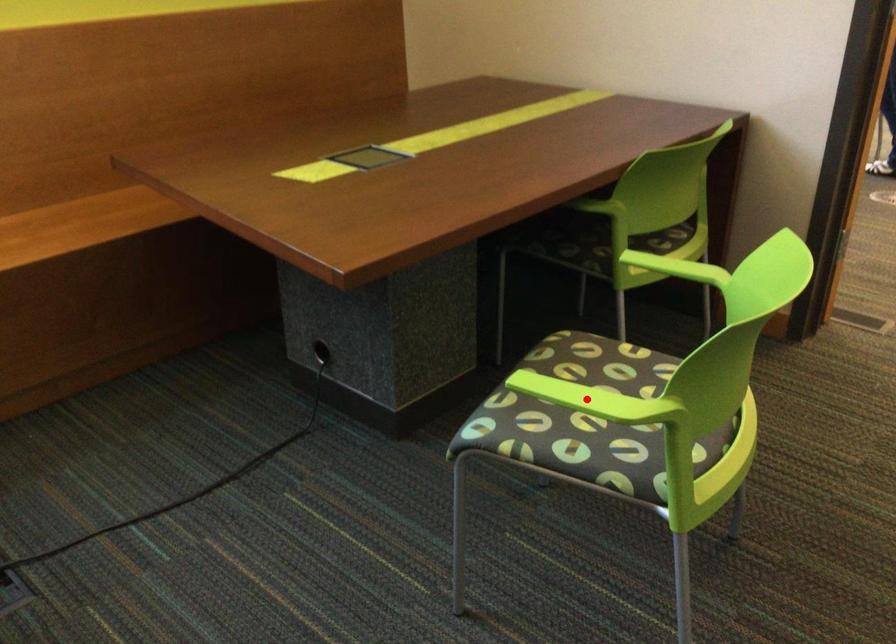
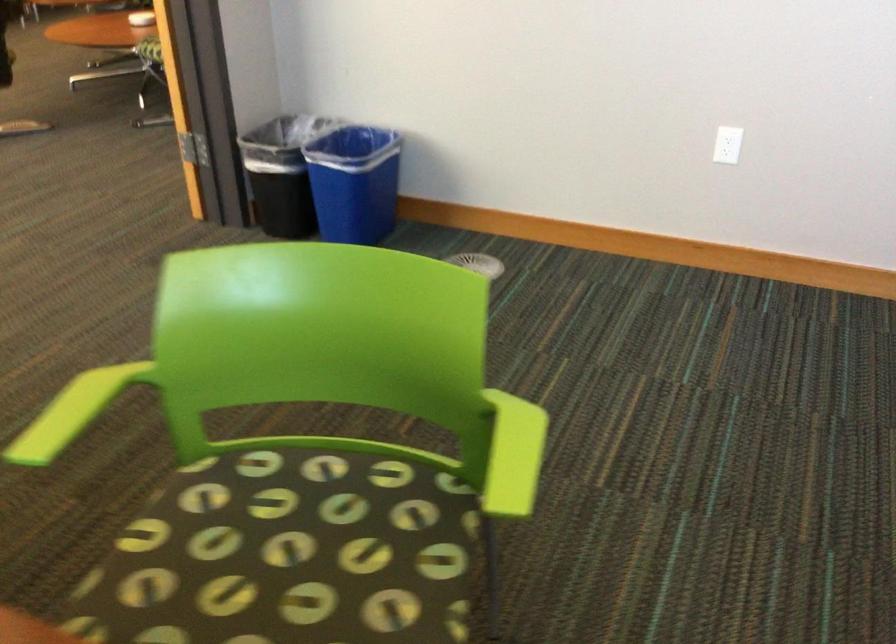
Where in the second image is the point corresponding to the highlighted location from the first image?

(513, 455)